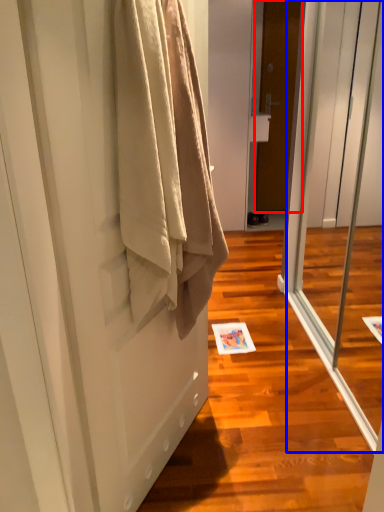
Question: Which point is closer to the camera, door (highlighted by a red box) or screen door (highlighted by a blue box)?

Choices:
 (A) door
 (B) screen door

Answer: (B)